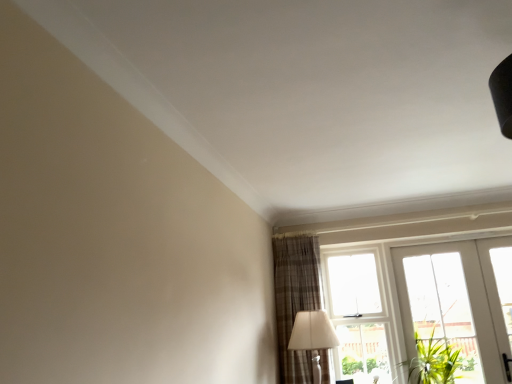
In order to click on white fabric lampshade at lower right in this screenshot , I will do `click(313, 336)`.

What do you see at coordinates (359, 315) in the screenshot? This screenshot has height=384, width=512. I see `transparent glass window at upper right` at bounding box center [359, 315].

Image resolution: width=512 pixels, height=384 pixels. Find the location of `plaid fabric curtain at lower right`. plaid fabric curtain at lower right is located at coordinates (295, 299).

Identify the location of white fabric lampshade at lower right. (313, 336).

Is white glossy door at lower right facing away from white fabric lampshade at lower right?

That's not correct — white glossy door at lower right is not looking away from white fabric lampshade at lower right.

In the image, there is a white fabric lampshade at lower right. What are the coordinates of `door above it (from the image's perspective)` in the screenshot? It's located at (460, 303).

Which object is positioned more to the right, white glossy door at lower right or white fabric lampshade at lower right?

From the viewer's perspective, white glossy door at lower right appears more on the right side.

Which is behind, point (450, 267) or point (321, 327)?

The point (450, 267) is farther from the camera.

Could you tell me if white glossy door at lower right is turned towards transparent glass window at upper right?

No, white glossy door at lower right is not facing towards transparent glass window at upper right.

Looking at this image, between white glossy door at lower right and transparent glass window at upper right, which one has smaller size?

Smaller between the two is transparent glass window at upper right.

How much distance is there between white glossy door at lower right and transparent glass window at upper right?

white glossy door at lower right is 19.63 inches away from transparent glass window at upper right.

Consider the image. From a real-world perspective, is white glossy door at lower right located higher than transparent glass window at upper right?

Incorrect, from a real-world perspective, white glossy door at lower right is lower than transparent glass window at upper right.

Which is less distant, (310, 340) or (423, 304)?

Point (310, 340) appears to be closer to the viewer than point (423, 304).

Is white fabric lampshade at lower right oriented towards white glossy door at lower right?

No, white fabric lampshade at lower right is not turned towards white glossy door at lower right.

Considering the sizes of objects white fabric lampshade at lower right and white glossy door at lower right in the image provided, who is bigger, white fabric lampshade at lower right or white glossy door at lower right?

Bigger between the two is white fabric lampshade at lower right.

Which is behind, white fabric lampshade at lower right or white glossy door at lower right?

white glossy door at lower right is more distant.

Can you tell me how much plaid fabric curtain at lower right and white glossy door at lower right differ in facing direction?

plaid fabric curtain at lower right and white glossy door at lower right are facing 1.1 degrees away from each other.

Between plaid fabric curtain at lower right and white glossy door at lower right, which one has larger size?

With larger size is plaid fabric curtain at lower right.

Does point (306, 288) come behind point (506, 281)?

Yes, point (306, 288) is farther from viewer.

Is plaid fabric curtain at lower right turned away from white glossy door at lower right?

No, plaid fabric curtain at lower right is not facing the opposite direction of white glossy door at lower right.

Between transparent glass window at upper right and white glossy door at lower right, which one has larger size?

white glossy door at lower right.

Are transparent glass window at upper right and white glossy door at lower right beside each other?

transparent glass window at upper right and white glossy door at lower right are clearly separated.

Is transparent glass window at upper right completely or partially outside of white glossy door at lower right?

Yes, transparent glass window at upper right is located beyond the bounds of white glossy door at lower right.

Could you tell me if transparent glass window at upper right is turned towards white glossy door at lower right?

No, transparent glass window at upper right is not facing towards white glossy door at lower right.

Does transparent glass window at upper right have a lesser height compared to plaid fabric curtain at lower right?

Yes.

How much distance is there between transparent glass window at upper right and plaid fabric curtain at lower right?

The distance of transparent glass window at upper right from plaid fabric curtain at lower right is 44.36 centimeters.

Are transparent glass window at upper right and plaid fabric curtain at lower right making contact?

There is a gap between transparent glass window at upper right and plaid fabric curtain at lower right.

In terms of size, does transparent glass window at upper right appear bigger or smaller than plaid fabric curtain at lower right?

transparent glass window at upper right is smaller than plaid fabric curtain at lower right.

How distant is white fabric lampshade at lower right from transparent glass window at upper right?

The distance of white fabric lampshade at lower right from transparent glass window at upper right is 56.46 centimeters.

From a real-world perspective, is white fabric lampshade at lower right over transparent glass window at upper right?

Actually, white fabric lampshade at lower right is physically below transparent glass window at upper right in the real world.

Which of these two, white fabric lampshade at lower right or transparent glass window at upper right, stands taller?

transparent glass window at upper right.

At what (x,y) coordinates should I click in order to perform the action: click on table lamp below the white glossy door at lower right (from a real-world perspective). Please return your answer as a coordinate pair (x, y). This screenshot has height=384, width=512. Looking at the image, I should click on (313, 336).

Where is `window on the left of white glossy door at lower right`? The image size is (512, 384). window on the left of white glossy door at lower right is located at coordinates (359, 315).

Looking at the image, which one is located further to white fabric lampshade at lower right, white glossy door at lower right or transparent glass window at upper right?

white glossy door at lower right is further to white fabric lampshade at lower right.

Looking at this image, considering their positions, is white fabric lampshade at lower right positioned further to transparent glass window at upper right than plaid fabric curtain at lower right?

The object further to transparent glass window at upper right is white fabric lampshade at lower right.

Based on their spatial positions, is transparent glass window at upper right or white glossy door at lower right further from plaid fabric curtain at lower right?

Among the two, white glossy door at lower right is located further to plaid fabric curtain at lower right.

Based on their spatial positions, is white fabric lampshade at lower right or transparent glass window at upper right further from white glossy door at lower right?

white fabric lampshade at lower right.

Based on their spatial positions, is white fabric lampshade at lower right or plaid fabric curtain at lower right closer to white glossy door at lower right?

plaid fabric curtain at lower right is closer to white glossy door at lower right.

Based on their spatial positions, is plaid fabric curtain at lower right or transparent glass window at upper right closer to white fabric lampshade at lower right?

plaid fabric curtain at lower right lies closer to white fabric lampshade at lower right than the other object.

From the image, which object appears to be farther from plaid fabric curtain at lower right, white glossy door at lower right or white fabric lampshade at lower right?

white glossy door at lower right is further to plaid fabric curtain at lower right.

Considering their positions, is white fabric lampshade at lower right positioned further to plaid fabric curtain at lower right than white glossy door at lower right?

white glossy door at lower right is positioned further to the anchor plaid fabric curtain at lower right.

Locate an element on the screen. This screenshot has height=384, width=512. window between plaid fabric curtain at lower right and white glossy door at lower right from left to right is located at coordinates (359, 315).

Identify the location of curtain between white fabric lampshade at lower right and transparent glass window at upper right along the z-axis. (295, 299).

You are a GUI agent. You are given a task and a screenshot of the screen. Output one action in this format:
    pyautogui.click(x=<x>, y=<y>)
    Task: Click on the table lamp situated between plaid fabric curtain at lower right and white glossy door at lower right from left to right
    
    Given the screenshot: What is the action you would take?
    pyautogui.click(x=313, y=336)

Where is `window between white fabric lampshade at lower right and white glossy door at lower right from left to right`? This screenshot has width=512, height=384. window between white fabric lampshade at lower right and white glossy door at lower right from left to right is located at coordinates (359, 315).